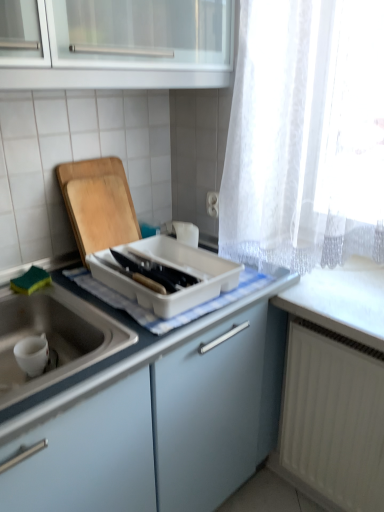
Question: Considering the positions of white plastic tray at center and white matte sink at lower left in the image, is white plastic tray at center taller or shorter than white matte sink at lower left?

Choices:
 (A) tall
 (B) short

Answer: (B)

Question: Considering their positions, is white plastic tray at center located in front of or behind white matte sink at lower left?

Choices:
 (A) front
 (B) behind

Answer: (B)

Question: Estimate the real-world distances between objects in this image. Which object is closer to the white matte sink at lower left?

Choices:
 (A) wooden cutting board at left
 (B) white matte radiator at lower right
 (C) white plastic tray at center

Answer: (C)

Question: Estimate the real-world distances between objects in this image. Which object is closer to the white plastic tray at center?

Choices:
 (A) white matte sink at lower left
 (B) wooden cutting board at left
 (C) white matte radiator at lower right

Answer: (B)